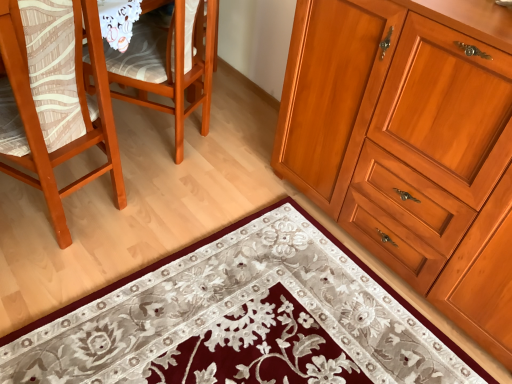
Find the location of a particular element. The width and height of the screenshot is (512, 384). free space in front of matte wood chair at left, the second chair when ordered from right to left is located at coordinates (50, 286).